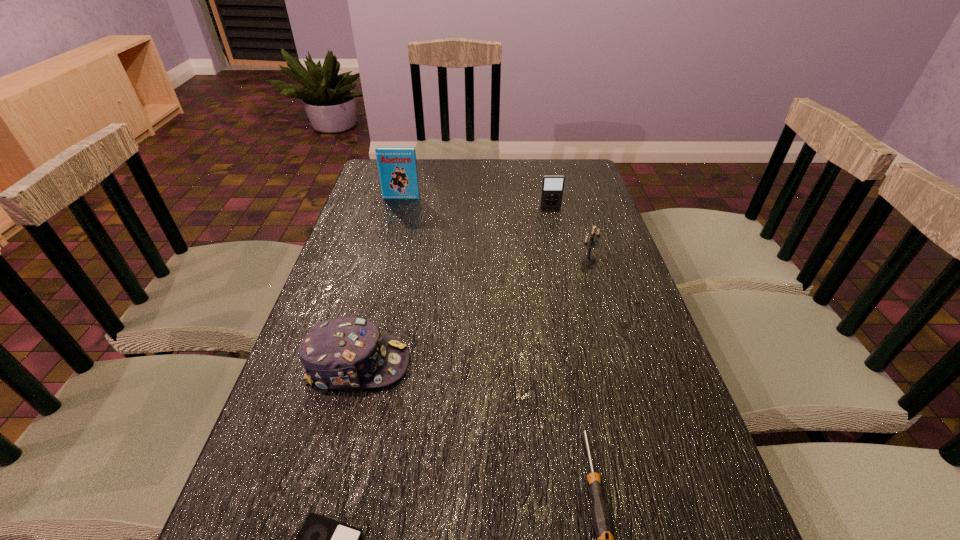
Locate an element on the screen. blank space that satisfies the following two spatial constraints: 1. on the front cover of the tallest object; 2. on the front-facing side of the fourth farthest object is located at coordinates click(359, 364).